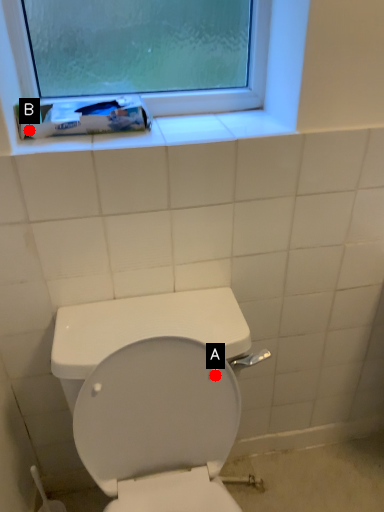
Question: Two points are circled on the image, labeled by A and B beside each circle. Among these points, which one is nearest to the camera?

Choices:
 (A) A is closer
 (B) B is closer

Answer: (B)